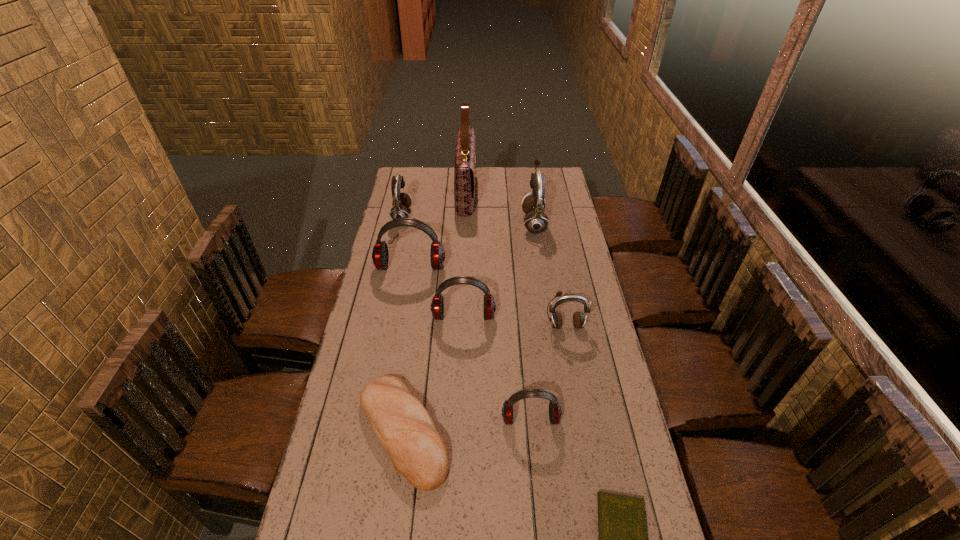
Image resolution: width=960 pixels, height=540 pixels. In order to click on the tallest object in this screenshot , I will do `click(464, 169)`.

Locate an element on the screen. handbag is located at coordinates (464, 169).

The image size is (960, 540). I want to click on the tallest earphone, so click(x=533, y=206).

Locate an element on the screen. Image resolution: width=960 pixels, height=540 pixels. the eighth shortest object is located at coordinates (533, 206).

In order to click on the farthest red earphone in this screenshot , I will do `click(380, 256)`.

Image resolution: width=960 pixels, height=540 pixels. Identify the location of the biggest red earphone. (380, 256).

At what (x,y) coordinates should I click in order to perform the action: click on the leftmost brown earphone. Please return your answer as a coordinate pair (x, y). The width and height of the screenshot is (960, 540). Looking at the image, I should click on (401, 202).

The width and height of the screenshot is (960, 540). I want to click on the second farthest red earphone, so click(437, 306).

Find the location of a particular element. the nearest brown earphone is located at coordinates (556, 319).

I want to click on the nearest red earphone, so click(x=555, y=412).